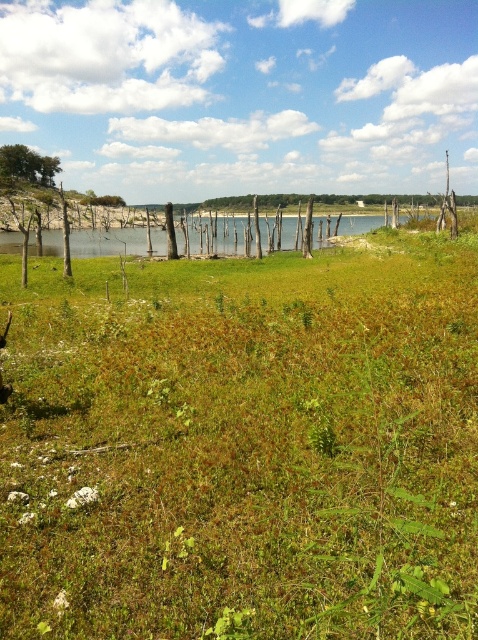
You are a hiker who wants to reach the green leafy tree at upper left from your current position near the green grassy at center. Considering the distance between them, can you estimate how long it would take you to walk there at a normal pace?

The distance between the green grassy at center and the green leafy tree at upper left is 106.56 meters. At a normal walking pace of approximately 1.4 meters per second, it would take roughly 76 seconds, or just over a minute, to reach the tree.

You are standing in the middle of the green grassy at center and want to walk towards the green leafy tree at upper left. Which direction should you face to head directly towards it?

You should face to the left because the green grassy at center is to the right of the green leafy tree at upper left, meaning the tree is located to your left side.

You are standing at the edge of the grassy foreground and want to walk towards the green grassy area at center. Based on the scene description, which direction should you head to reach the green grassy at center?

The green grassy at center is located at point (243, 449), so you should head towards the center of the image to reach it.